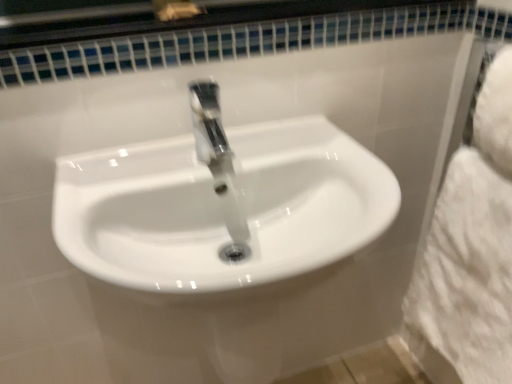
Question: Which is correct: white fluffy bath towel at right is inside white glossy sink at center, or outside of it?

Choices:
 (A) outside
 (B) inside

Answer: (A)

Question: Relative to white glossy sink at center, is white fluffy bath towel at right in front or behind?

Choices:
 (A) front
 (B) behind

Answer: (B)

Question: From the image's perspective, is white fluffy bath towel at right located above or below white glossy sink at center?

Choices:
 (A) above
 (B) below

Answer: (A)

Question: Is white glossy sink at center inside the boundaries of white fluffy bath towel at right, or outside?

Choices:
 (A) inside
 (B) outside

Answer: (B)

Question: Considering the positions of point (282, 132) and point (487, 329), is point (282, 132) closer or farther from the camera than point (487, 329)?

Choices:
 (A) farther
 (B) closer

Answer: (A)

Question: Is white glossy sink at center to the left or to the right of white fluffy bath towel at right in the image?

Choices:
 (A) right
 (B) left

Answer: (B)

Question: In terms of height, does white glossy sink at center look taller or shorter compared to white fluffy bath towel at right?

Choices:
 (A) tall
 (B) short

Answer: (B)